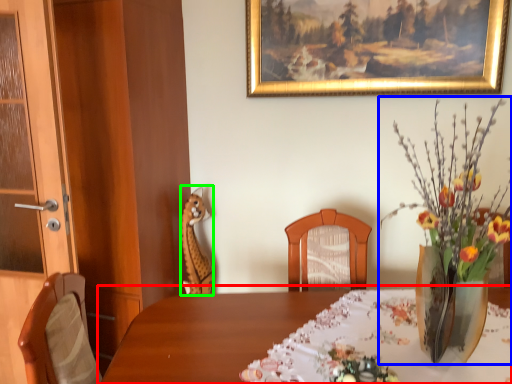
Question: Estimate the real-world distances between objects in this image. Which object is farther from table (highlighted by a red box), floral arrangement (highlighted by a blue box) or animal (highlighted by a green box)?

Choices:
 (A) floral arrangement
 (B) animal

Answer: (B)